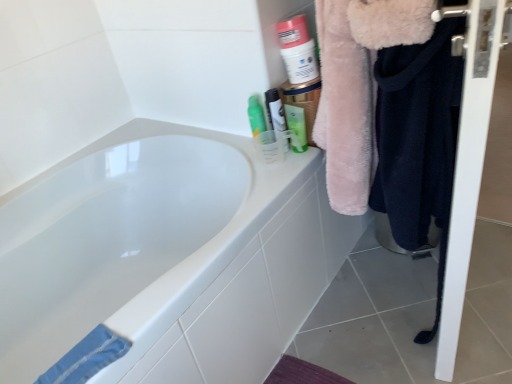
This screenshot has width=512, height=384. I want to click on vacant space that is to the left of translucent plastic cup at upper right, the 2th mouthwash in the right-to-left sequence, so click(240, 145).